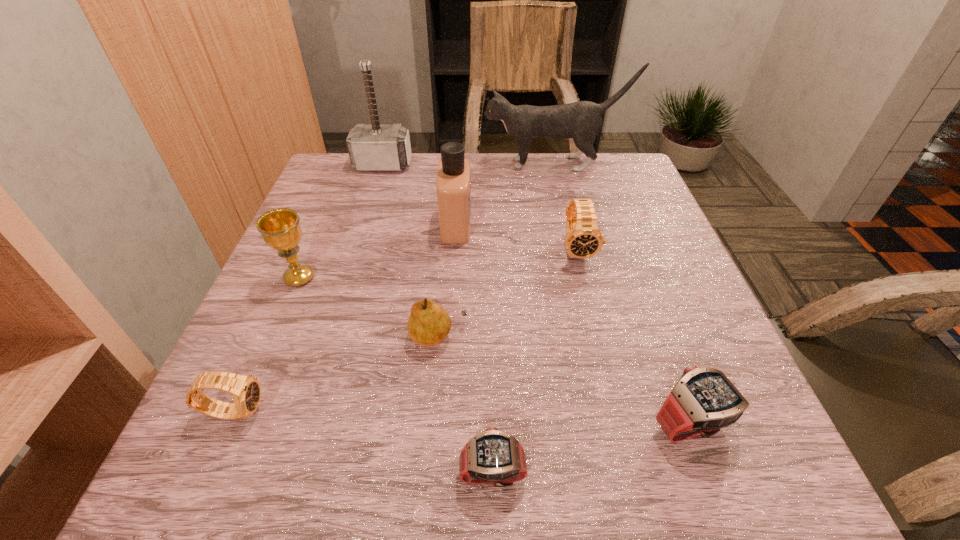
In the image, there is a desktop. At what (x,y) coordinates should I click in order to perform the action: click on vacant space at the near left corner. Please return your answer as a coordinate pair (x, y). Looking at the image, I should click on (180, 470).

You are a GUI agent. You are given a task and a screenshot of the screen. Output one action in this format:
    pyautogui.click(x=<x>, y=<y>)
    Task: Click on the vacant space at the far right corner of the desktop
    
    Given the screenshot: What is the action you would take?
    pyautogui.click(x=612, y=178)

At what (x,y) coordinates should I click in order to perform the action: click on vacant region between the beige perfume and the tallest watch. Please return your answer as a coordinate pair (x, y). The width and height of the screenshot is (960, 540). Looking at the image, I should click on (516, 237).

Where is `free point between the shortest watch and the rightmost watch`? This screenshot has width=960, height=540. free point between the shortest watch and the rightmost watch is located at coordinates tap(591, 449).

You are a GUI agent. You are given a task and a screenshot of the screen. Output one action in this format:
    pyautogui.click(x=<x>, y=<y>)
    Task: Click on the vacant region between the sixth shortest object and the hammer
    This screenshot has width=960, height=540.
    Given the screenshot: What is the action you would take?
    (341, 221)

Identify the location of free point between the cat and the shortest watch. The height and width of the screenshot is (540, 960). (523, 318).

Where is `free space between the left black watch and the left red watch`? free space between the left black watch and the left red watch is located at coordinates (364, 442).

Where is `vacant area that lies between the bigger red watch and the cat`? The height and width of the screenshot is (540, 960). vacant area that lies between the bigger red watch and the cat is located at coordinates (622, 294).

This screenshot has width=960, height=540. In order to click on blank region between the cat and the sixth shortest object in this screenshot , I will do (x=427, y=221).

What are the coordinates of `vacant region between the cat and the sixth shortest object` in the screenshot? It's located at (427, 221).